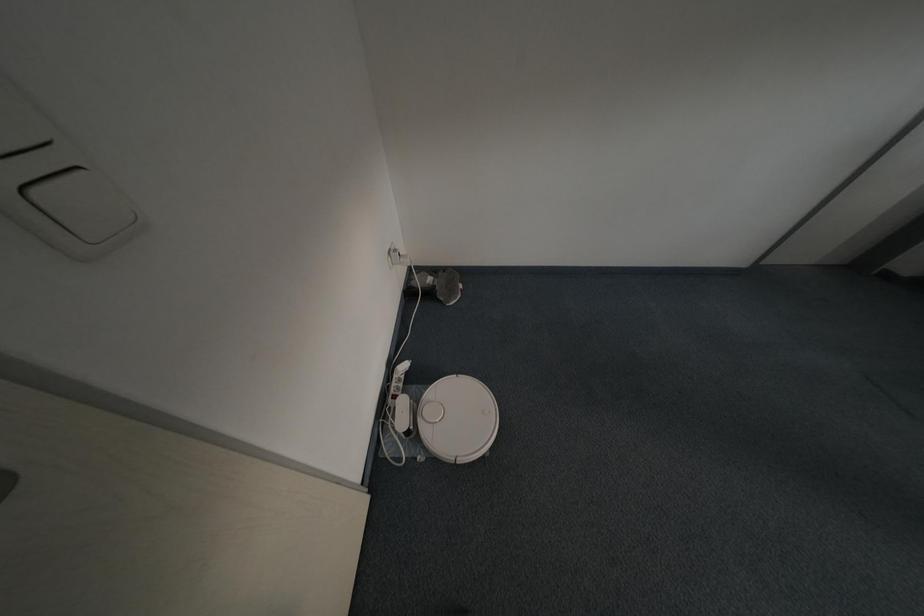
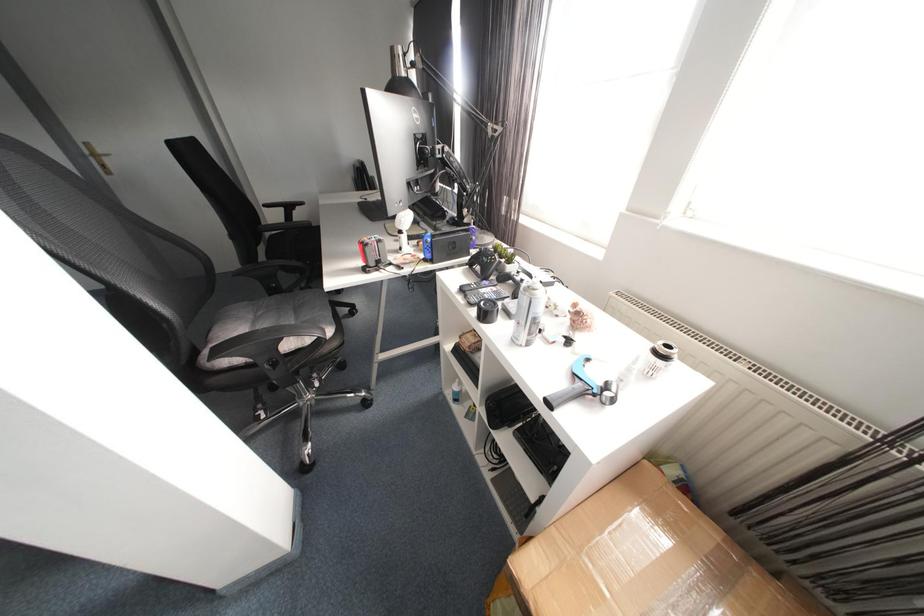
Question: What movement of the cameraman would produce the second image?

Choices:
 (A) Left
 (B) Right
 (C) Forward
 (D) Backward

Answer: (B)